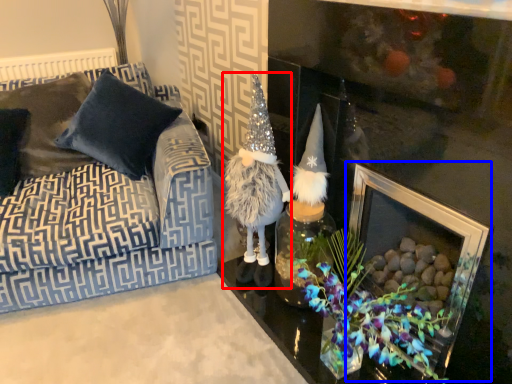
Question: Which object appears farthest to the camera in this image, figurine (highlighted by a red box) or picture frame (highlighted by a blue box)?

Choices:
 (A) figurine
 (B) picture frame

Answer: (A)